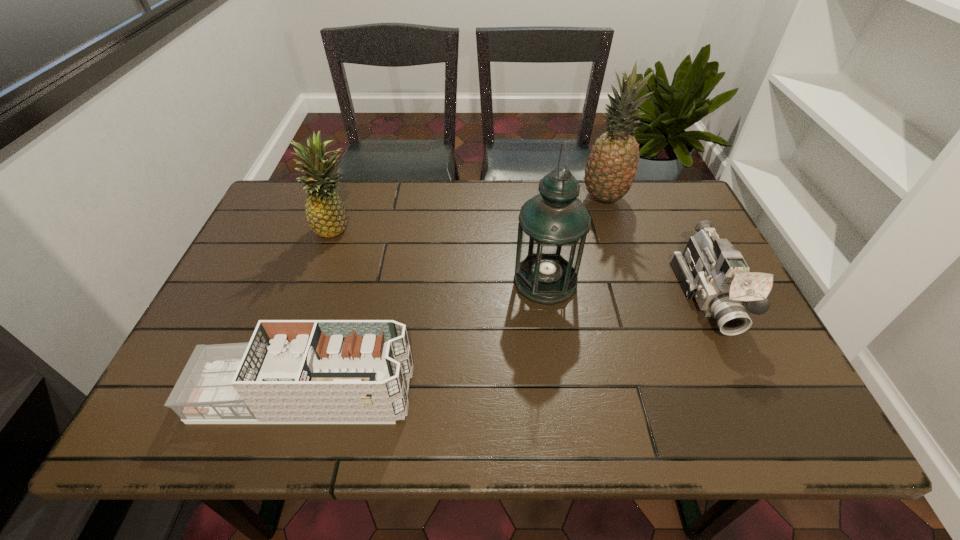
I want to click on the farthest object, so click(612, 165).

Image resolution: width=960 pixels, height=540 pixels. I want to click on the farther pineapple, so click(x=612, y=165).

The image size is (960, 540). Find the location of `oil lamp`. oil lamp is located at coordinates (553, 225).

The width and height of the screenshot is (960, 540). I want to click on the fourth nearest object, so (x=326, y=215).

Where is `the shorter pineapple`? This screenshot has height=540, width=960. the shorter pineapple is located at coordinates tap(326, 215).

Locate an element on the screen. The image size is (960, 540). camcorder is located at coordinates point(711,270).

You are a GUI agent. You are given a task and a screenshot of the screen. Output one action in this format:
    pyautogui.click(x=<x>, y=<y>)
    Task: Click on the shortest object
    
    Given the screenshot: What is the action you would take?
    pyautogui.click(x=303, y=371)

I want to click on the nearest object, so click(303, 371).

Locate an element on the screen. This screenshot has width=960, height=540. vacant space located on the front of the farther pineapple is located at coordinates (618, 242).

Identify the location of free space located 0.100m on the front of the third object from left to right. This screenshot has width=960, height=540. (554, 339).